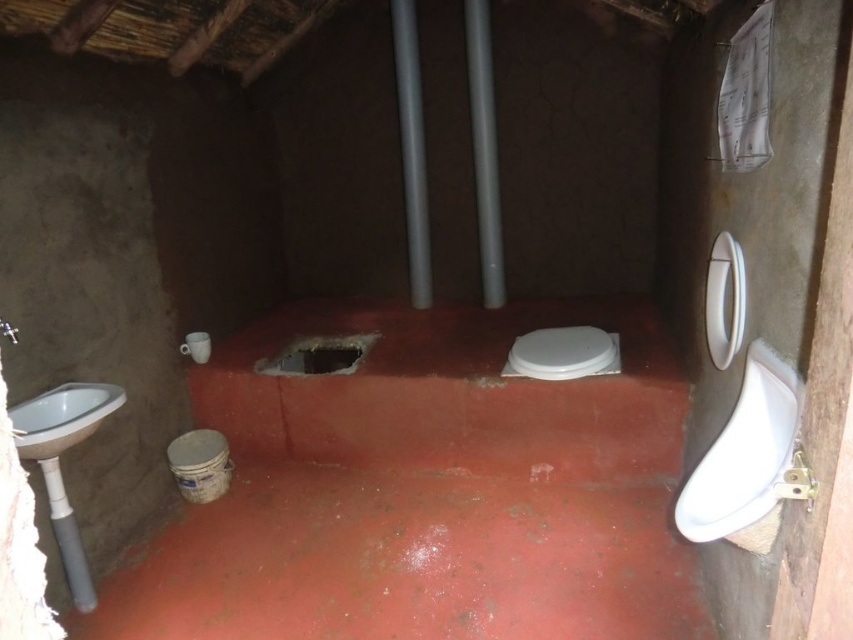
You are a maintenance worker checking the bathroom layout. The smooth concrete floor at center and the white glossy sink at left are two key fixtures. From the perspective of someone standing in the bathroom, which object is positioned lower in the scene?

The smooth concrete floor at center is located below the white glossy sink at left, so it is positioned lower in the scene.

You are a maintenance worker checking the bathroom facilities. You need to determine if the white glossy toilet bowl at center is positioned lower than the smooth concrete floor at center. Based on the scene description, what is your conclusion?

The smooth concrete floor at center is taller than the white glossy toilet bowl at center, so the white glossy toilet bowl at center is positioned lower than the smooth concrete floor at center.